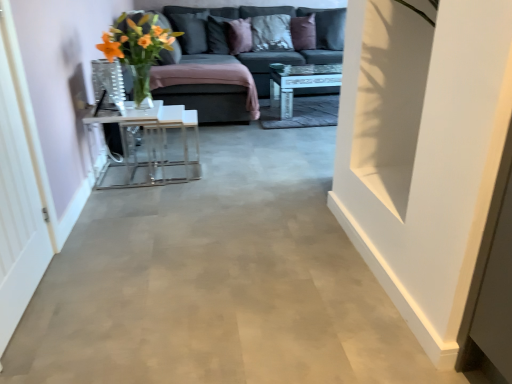
Locate an element on the screen. This screenshot has height=384, width=512. translucent glass vase at upper center is located at coordinates (137, 40).

The height and width of the screenshot is (384, 512). Describe the element at coordinates (19, 188) in the screenshot. I see `transparent glass door at left` at that location.

Describe the element at coordinates (151, 143) in the screenshot. The height and width of the screenshot is (384, 512). I see `clear glass table at center, positioned as the first table in bottom-to-top order` at that location.

How much space does clear glass table at center, marked as the 2th table in a top-to-bottom arrangement, occupy horizontally?

It is 16.24 inches.

In order to face dark gray fabric couch at upper center, should I rotate leftwards or rightwards?

Rotate your view right by about 0.855°.

Find the location of a particular element. The image size is (512, 384). translucent glass vase at upper left is located at coordinates (137, 48).

Locate an element on the screen. The image size is (512, 384). translucent glass vase at upper center is located at coordinates (137, 40).

Considering the relative positions of white matte door at right and matte black pillow at upper center, which is the fifth pillow in right-to-left order, in the image provided, is white matte door at right to the right of matte black pillow at upper center, which is the fifth pillow in right-to-left order, from the viewer's perspective?

Yes.

Is there a large distance between white matte door at right and matte black pillow at upper center, which appears as the 1th pillow when viewed from the left?

Yes, white matte door at right and matte black pillow at upper center, which appears as the 1th pillow when viewed from the left, are located far from each other.

Is point (374, 58) farther from viewer compared to point (206, 51)?

No, it is in front of (206, 51).

Is white matte door at right closer to the viewer compared to matte black pillow at upper center, which is the fifth pillow in right-to-left order?

Yes, the depth of white matte door at right is less than that of matte black pillow at upper center, which is the fifth pillow in right-to-left order.

Find the location of a particular element. The image size is (512, 384). table that is the 2nd object located in front of the purple velvet pillow at upper center, which is the fifth pillow in left-to-right order is located at coordinates (151, 143).

Is point (290, 25) positioned in front of point (155, 125)?

No.

Considering the sizes of objects purple velvet pillow at upper center, which is the fifth pillow in left-to-right order, and clear glass table at center, marked as the second table in a right-to-left arrangement, in the image provided, who is thinner, purple velvet pillow at upper center, which is the fifth pillow in left-to-right order, or clear glass table at center, marked as the second table in a right-to-left arrangement,?

Thinner between the two is purple velvet pillow at upper center, which is the fifth pillow in left-to-right order.

Where is `glass door below the textured gray pillow at upper center, which is counted as the 4th pillow, starting from the left (from the image's perspective)`? Image resolution: width=512 pixels, height=384 pixels. glass door below the textured gray pillow at upper center, which is counted as the 4th pillow, starting from the left (from the image's perspective) is located at coordinates (19, 188).

Is textured gray pillow at upper center, which is counted as the 4th pillow, starting from the left, beside transparent glass door at left?

No, textured gray pillow at upper center, which is counted as the 4th pillow, starting from the left, is not with transparent glass door at left.

Who is taller, textured gray pillow at upper center, which is counted as the 4th pillow, starting from the left, or transparent glass door at left?

Standing taller between the two is transparent glass door at left.

Does point (285, 29) appear closer or farther from the camera than point (9, 89)?

Point (285, 29) is positioned farther from the camera compared to point (9, 89).

Who is taller, translucent glass vase at upper center or purple velvet pillow at upper center, which is the fifth pillow in left-to-right order?

Standing taller between the two is translucent glass vase at upper center.

Does translucent glass vase at upper center come in front of purple velvet pillow at upper center, marked as the first pillow in a right-to-left arrangement?

That is True.

Who is smaller, translucent glass vase at upper center or purple velvet pillow at upper center, marked as the first pillow in a right-to-left arrangement?

Smaller between the two is purple velvet pillow at upper center, marked as the first pillow in a right-to-left arrangement.

Based on the photo, from the image's perspective, which one is positioned lower, translucent glass vase at upper center or purple velvet pillow at upper center, which is the fifth pillow in left-to-right order?

translucent glass vase at upper center, from the image's perspective.

From the image's perspective, is translucent glass vase at upper left located above or below transparent glass door at left?

translucent glass vase at upper left is above transparent glass door at left.

Is translucent glass vase at upper left turned away from transparent glass door at left?

No, transparent glass door at left is not at the back of translucent glass vase at upper left.

Is translucent glass vase at upper left touching transparent glass door at left?

No, translucent glass vase at upper left is not making contact with transparent glass door at left.

Considering the relative positions of purple velvet pillow at upper center, the 3th pillow when ordered from right to left, and translucent glass vase at upper left in the image provided, is purple velvet pillow at upper center, the 3th pillow when ordered from right to left, to the right of translucent glass vase at upper left from the viewer's perspective?

Correct, you'll find purple velvet pillow at upper center, the 3th pillow when ordered from right to left, to the right of translucent glass vase at upper left.

Is purple velvet pillow at upper center, the third pillow positioned from the left, touching translucent glass vase at upper left?

No, purple velvet pillow at upper center, the third pillow positioned from the left, is not next to translucent glass vase at upper left.

Considering the sizes of purple velvet pillow at upper center, the 3th pillow when ordered from right to left, and translucent glass vase at upper left in the image, is purple velvet pillow at upper center, the 3th pillow when ordered from right to left, bigger or smaller than translucent glass vase at upper left?

Considering their sizes, purple velvet pillow at upper center, the 3th pillow when ordered from right to left, takes up less space than translucent glass vase at upper left.

Is translucent glass vase at upper center not within white glossy coffee table at center, which is the 1th table from right to left?

Absolutely, translucent glass vase at upper center is external to white glossy coffee table at center, which is the 1th table from right to left.

Considering the sizes of translucent glass vase at upper center and white glossy coffee table at center, which is the 1th table from right to left, in the image, is translucent glass vase at upper center taller or shorter than white glossy coffee table at center, which is the 1th table from right to left,?

Considering their sizes, translucent glass vase at upper center has more height than white glossy coffee table at center, which is the 1th table from right to left.

From a real-world perspective, is translucent glass vase at upper center physically located above or below white glossy coffee table at center, the 2th table in the front-to-back sequence?

translucent glass vase at upper center is situated higher than white glossy coffee table at center, the 2th table in the front-to-back sequence, in the real world.

Considering the sizes of objects translucent glass vase at upper center and white glossy coffee table at center, placed as the 1th table when sorted from top to bottom, in the image provided, who is thinner, translucent glass vase at upper center or white glossy coffee table at center, placed as the 1th table when sorted from top to bottom,?

translucent glass vase at upper center.

Where is `the 4th pillow directly above the white matte door at right (from a real-world perspective)`? the 4th pillow directly above the white matte door at right (from a real-world perspective) is located at coordinates (191, 31).

Starting from the purple velvet pillow at upper center, marked as the first pillow in a right-to-left arrangement, which table is the 2nd one in front? Please provide its 2D coordinates.

[(151, 143)]

Estimate the real-world distances between objects in this image. Which object is further from purple velvet pillow at upper center, the 3th pillow when ordered from right to left, white glossy coffee table at center, which is the 2th table in left-to-right order, or dark gray fabric pillow at upper center, positioned as the 2th pillow in left-to-right order?

Based on the image, white glossy coffee table at center, which is the 2th table in left-to-right order, appears to be further to purple velvet pillow at upper center, the 3th pillow when ordered from right to left.

In the scene shown: Considering their positions, is transparent glass door at left positioned further to clear glass table at center, the 2th table viewed from the back, than matte black pillow at upper center, which is the fifth pillow in right-to-left order?

matte black pillow at upper center, which is the fifth pillow in right-to-left order.

Estimate the real-world distances between objects in this image. Which object is closer to dark gray fabric pillow at upper center, positioned as the 2th pillow in left-to-right order, translucent glass vase at upper left or matte black pillow at upper center, which appears as the 1th pillow when viewed from the left?

Based on the image, matte black pillow at upper center, which appears as the 1th pillow when viewed from the left, appears to be nearer to dark gray fabric pillow at upper center, positioned as the 2th pillow in left-to-right order.

Estimate the real-world distances between objects in this image. Which object is closer to textured gray pillow at upper center, the second pillow from the right, dark gray fabric couch at upper center or matte black pillow at upper center, which is the fifth pillow in right-to-left order?

dark gray fabric couch at upper center.

Considering their positions, is textured gray pillow at upper center, which is counted as the 4th pillow, starting from the left, positioned closer to dark gray fabric pillow at upper center, positioned as the 2th pillow in left-to-right order, than translucent glass vase at upper center?

Based on the image, textured gray pillow at upper center, which is counted as the 4th pillow, starting from the left, appears to be nearer to dark gray fabric pillow at upper center, positioned as the 2th pillow in left-to-right order.

When comparing their distances from clear glass table at center, positioned as the first table in bottom-to-top order, does white glossy coffee table at center, positioned as the first table in back-to-front order, or purple velvet pillow at upper center, which is the fifth pillow in left-to-right order, seem further?

Among the two, purple velvet pillow at upper center, which is the fifth pillow in left-to-right order, is located further to clear glass table at center, positioned as the first table in bottom-to-top order.

From the picture: Estimate the real-world distances between objects in this image. Which object is closer to dark gray fabric couch at upper center, translucent glass vase at upper center or white glossy coffee table at center, the 2th table in the front-to-back sequence?

white glossy coffee table at center, the 2th table in the front-to-back sequence.

Consider the image. Estimate the real-world distances between objects in this image. Which object is closer to dark gray fabric pillow at upper center, positioned as the 2th pillow in left-to-right order, dark gray fabric couch at upper center or matte black pillow at upper center, which is the fifth pillow in right-to-left order?

matte black pillow at upper center, which is the fifth pillow in right-to-left order, lies closer to dark gray fabric pillow at upper center, positioned as the 2th pillow in left-to-right order, than the other object.

This screenshot has width=512, height=384. What are the coordinates of `flower between transparent glass door at left and dark gray fabric pillow at upper center, the 4th pillow in the right-to-left sequence, in the front-back direction` in the screenshot? It's located at (137, 40).

This screenshot has height=384, width=512. Identify the location of floral arrangement located between transparent glass door at left and dark gray fabric pillow at upper center, positioned as the 2th pillow in left-to-right order, in the depth direction. (137, 48).

At what (x,y) coordinates should I click in order to perform the action: click on floral arrangement between white matte door at right and purple velvet pillow at upper center, marked as the first pillow in a right-to-left arrangement, along the z-axis. Please return your answer as a coordinate pair (x, y). Looking at the image, I should click on (137, 48).

In order to click on studio couch between translucent glass vase at upper left and white glossy coffee table at center, which is the 2th table in left-to-right order, along the z-axis in this screenshot , I will do `click(245, 57)`.